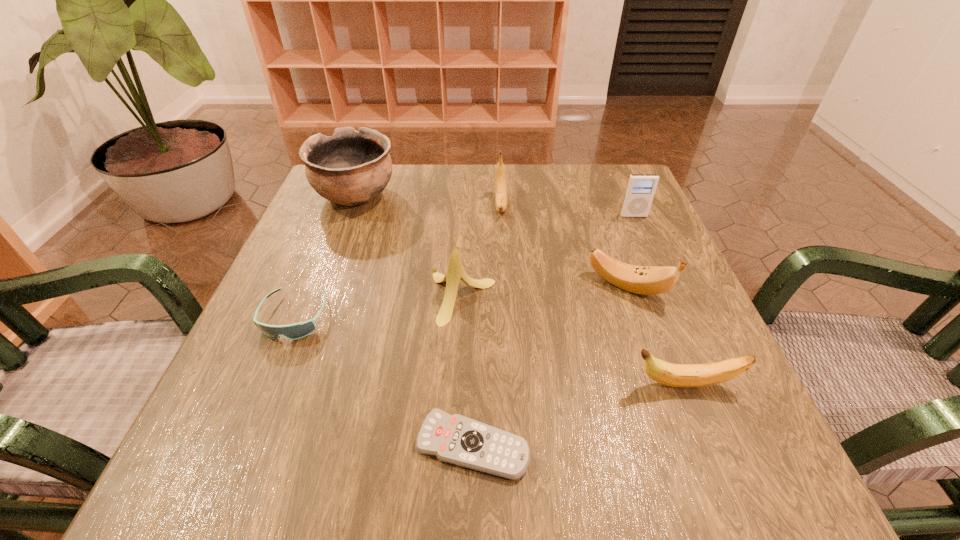
Where is `vacant area at the near edge`? The image size is (960, 540). vacant area at the near edge is located at coordinates click(424, 468).

Where is `vacant region at the left edge`? The image size is (960, 540). vacant region at the left edge is located at coordinates (313, 239).

In the image, there is a desktop. Find the location of `vacant space at the right edge`. vacant space at the right edge is located at coordinates (667, 423).

Where is `vacant space at the far left corner of the desktop`? vacant space at the far left corner of the desktop is located at coordinates (316, 214).

The width and height of the screenshot is (960, 540). In the image, there is a desktop. Identify the location of vacant space at the far right corner. (613, 186).

Find the location of a particular element. The image size is (960, 540). empty space between the pottery and the leftmost banana is located at coordinates (409, 247).

Image resolution: width=960 pixels, height=540 pixels. What are the coordinates of `unoccupied area between the leftmost banana and the third tallest banana` in the screenshot? It's located at 544,292.

This screenshot has width=960, height=540. Find the location of `free space between the second nearest object and the iPod`. free space between the second nearest object and the iPod is located at coordinates (659, 300).

Identify the location of free space between the iPod and the goggles. (465, 266).

Locate an element on the screen. The image size is (960, 540). unoccupied position between the second shortest object and the iPod is located at coordinates (465, 266).